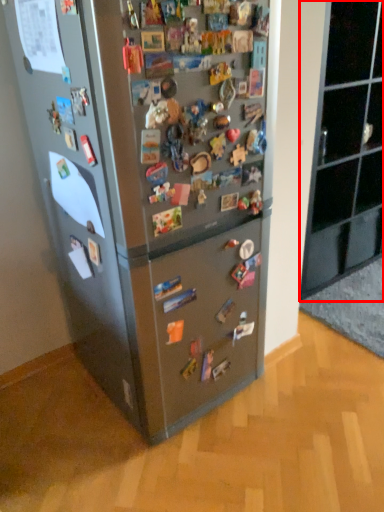
Question: Observing the image, what is the correct spatial positioning of cabinetry (annotated by the red box) in reference to refrigerator?

Choices:
 (A) left
 (B) right

Answer: (B)